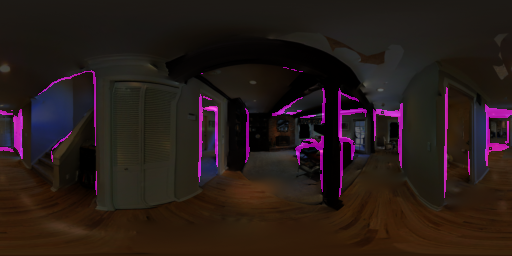
Locate an element on the screen. floor is located at coordinates (248, 230).